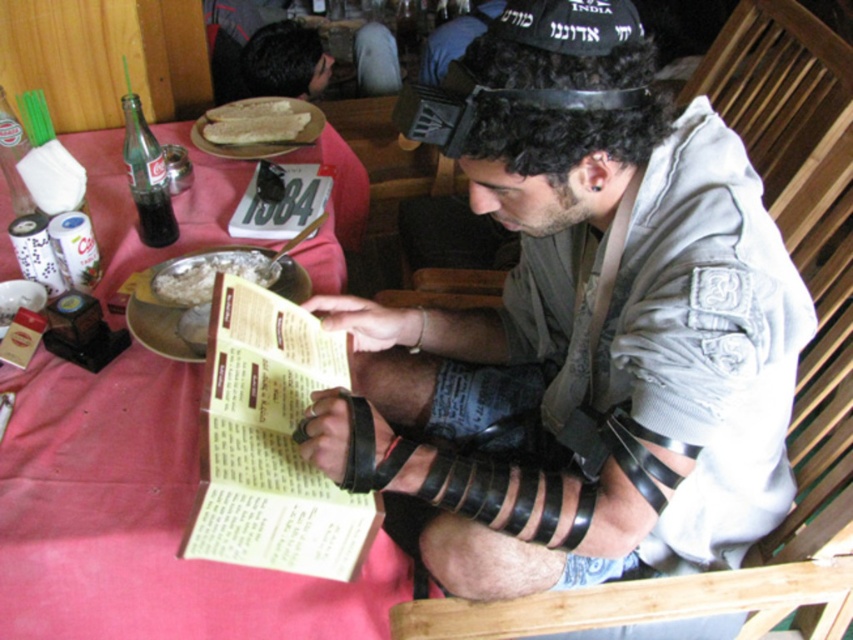
Which is above, black fabric baseball hat at upper center or white flatbread at upper center?

Positioned higher is white flatbread at upper center.

Is point (503, 17) closer to camera compared to point (262, 124)?

Yes.

Does point (552, 20) come in front of point (265, 108)?

Yes, point (552, 20) is closer to viewer.

Find the location of a particular element. The width and height of the screenshot is (853, 640). black fabric baseball hat at upper center is located at coordinates (569, 24).

From the picture: Which is below, black leather tefillin at center or white flatbread at upper center?

black leather tefillin at center is lower down.

Measure the distance between point (693,157) and camera.

80.67 centimeters

Does point (349, 410) lie behind point (252, 136)?

No, it is not.

You are a GUI agent. You are given a task and a screenshot of the screen. Output one action in this format:
    pyautogui.click(x=<x>, y=<y>)
    Task: Click on the black leather tefillin at center
    
    Given the screenshot: What is the action you would take?
    pyautogui.click(x=585, y=337)

Which of these two, black leather tefillin at center or yellow paper at center, stands shorter?

yellow paper at center

Is point (509, 292) behind point (268, 564)?

Yes, point (509, 292) is behind point (268, 564).

At what (x,y) coordinates should I click in order to perform the action: click on black leather tefillin at center. Please return your answer as a coordinate pair (x, y). This screenshot has width=853, height=640. Looking at the image, I should click on (585, 337).